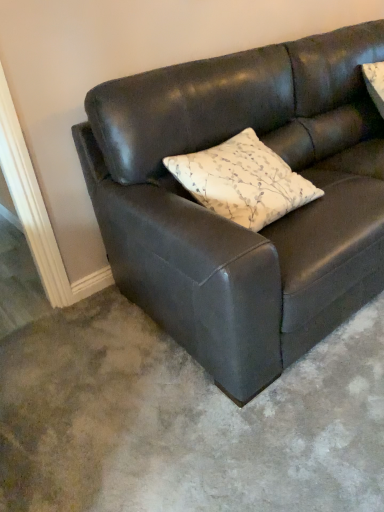
The image size is (384, 512). What do you see at coordinates (243, 181) in the screenshot?
I see `white floral-patterned pillow at center` at bounding box center [243, 181].

Identify the location of white floral-patterned pillow at center. Image resolution: width=384 pixels, height=512 pixels. (243, 181).

The image size is (384, 512). Describe the element at coordinates (234, 223) in the screenshot. I see `matte black couch at center` at that location.

Identify the location of matte black couch at center. Image resolution: width=384 pixels, height=512 pixels. (234, 223).

I want to click on white floral-patterned pillow at center, so click(x=243, y=181).

Is matte black couch at center to the left of white floral-patterned pillow at center from the viewer's perspective?

No, matte black couch at center is not to the left of white floral-patterned pillow at center.

Is matte black couch at center further to the viewer compared to white floral-patterned pillow at center?

No, it is not.

Is point (143, 290) farther from viewer compared to point (163, 162)?

Yes, point (143, 290) is farther from viewer.

From the image's perspective, is matte black couch at center located beneath white floral-patterned pillow at center?

No, from the image's perspective, matte black couch at center is not below white floral-patterned pillow at center.

From a real-world perspective, is matte black couch at center physically located above or below white floral-patterned pillow at center?

matte black couch at center is below white floral-patterned pillow at center.

Considering the sizes of objects matte black couch at center and white floral-patterned pillow at center in the image provided, who is wider, matte black couch at center or white floral-patterned pillow at center?

matte black couch at center.

Is matte black couch at center taller than white floral-patterned pillow at center?

Indeed, matte black couch at center has a greater height compared to white floral-patterned pillow at center.

Can you confirm if matte black couch at center is bigger than white floral-patterned pillow at center?

Yes.

Can white floral-patterned pillow at center be found inside matte black couch at center?

Yes, white floral-patterned pillow at center is surrounded by matte black couch at center.

Are matte black couch at center and white floral-patterned pillow at center far apart?

Actually, matte black couch at center and white floral-patterned pillow at center are a little close together.

Is matte black couch at center looking in the opposite direction of white floral-patterned pillow at center?

Yes, matte black couch at center is facing away from white floral-patterned pillow at center.

How many degrees apart are the facing directions of matte black couch at center and white floral-patterned pillow at center?

The angle between the facing direction of matte black couch at center and the facing direction of white floral-patterned pillow at center is 1.11 degrees.

Measure the distance from matte black couch at center to white floral-patterned pillow at center.

The distance of matte black couch at center from white floral-patterned pillow at center is 25.02 centimeters.

Locate an element on the screen. pillow below the matte black couch at center (from the image's perspective) is located at coordinates (243, 181).

Looking at this image, considering the positions of objects white floral-patterned pillow at center and matte black couch at center in the image provided, who is more to the left, white floral-patterned pillow at center or matte black couch at center?

white floral-patterned pillow at center.

Which object is closer to the camera, white floral-patterned pillow at center or matte black couch at center?

matte black couch at center.

Which is closer, (250, 159) or (233, 78)?

→ The point (250, 159) is more forward.

From the image's perspective, between white floral-patterned pillow at center and matte black couch at center, which one is located above?

matte black couch at center, from the image's perspective.

From a real-world perspective, is white floral-patterned pillow at center beneath matte black couch at center?

No.

Between white floral-patterned pillow at center and matte black couch at center, which one has larger width?

matte black couch at center.

From their relative heights in the image, would you say white floral-patterned pillow at center is taller or shorter than matte black couch at center?

Clearly, white floral-patterned pillow at center is shorter compared to matte black couch at center.

Who is smaller, white floral-patterned pillow at center or matte black couch at center?

white floral-patterned pillow at center is smaller.

Is matte black couch at center located within white floral-patterned pillow at center?

Actually, matte black couch at center is outside white floral-patterned pillow at center.

Would you say white floral-patterned pillow at center is a long distance from matte black couch at center?

No, white floral-patterned pillow at center is not far away from matte black couch at center.

Is white floral-patterned pillow at center positioned with its back to matte black couch at center?

Yes.

This screenshot has height=512, width=384. Find the location of `pillow located below the matte black couch at center (from the image's perspective)`. pillow located below the matte black couch at center (from the image's perspective) is located at coordinates (243, 181).

This screenshot has width=384, height=512. In order to click on studio couch lying in front of the white floral-patterned pillow at center in this screenshot , I will do `click(234, 223)`.

Where is `pillow that appears on the left of matte black couch at center`? This screenshot has width=384, height=512. pillow that appears on the left of matte black couch at center is located at coordinates point(243,181).